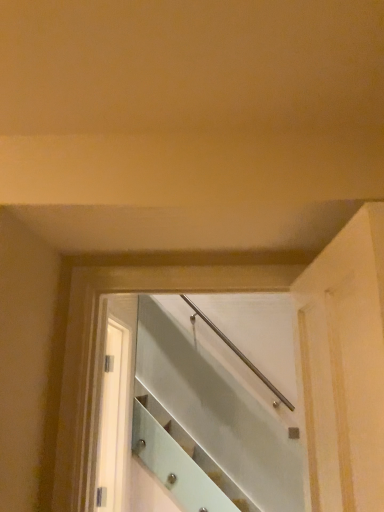
Question: Should I look upward or downward to see white glossy screen door at center?

Choices:
 (A) down
 (B) up

Answer: (A)